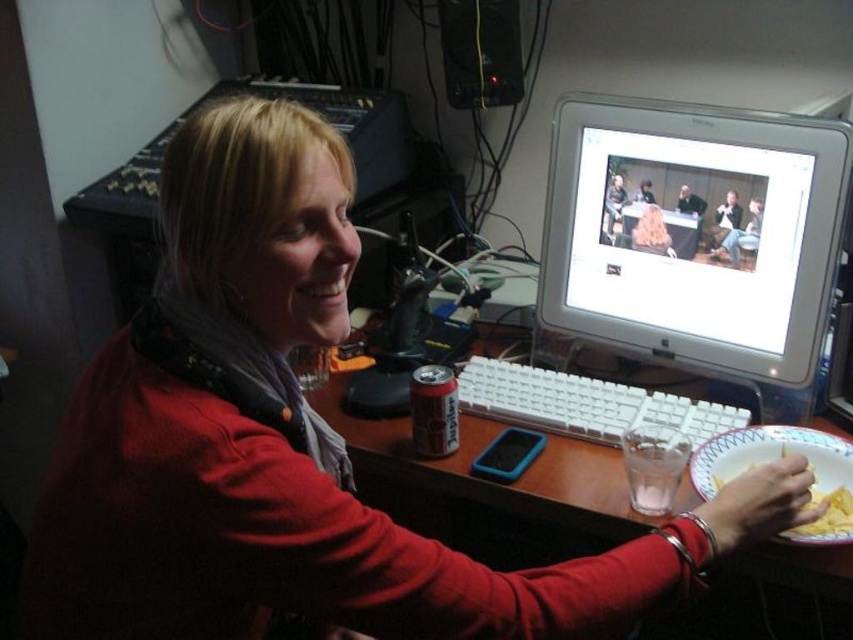
You are setting up a video call and need to place your white paper plate at lower right near the white glossy monitor at upper center. Since the monitor is bigger, will the plate fit comfortably next to it without blocking the screen?

The white glossy monitor at upper center is bigger than the white paper plate at lower right, so there should be enough space to place the white paper plate at lower right next to it without blocking the screen.